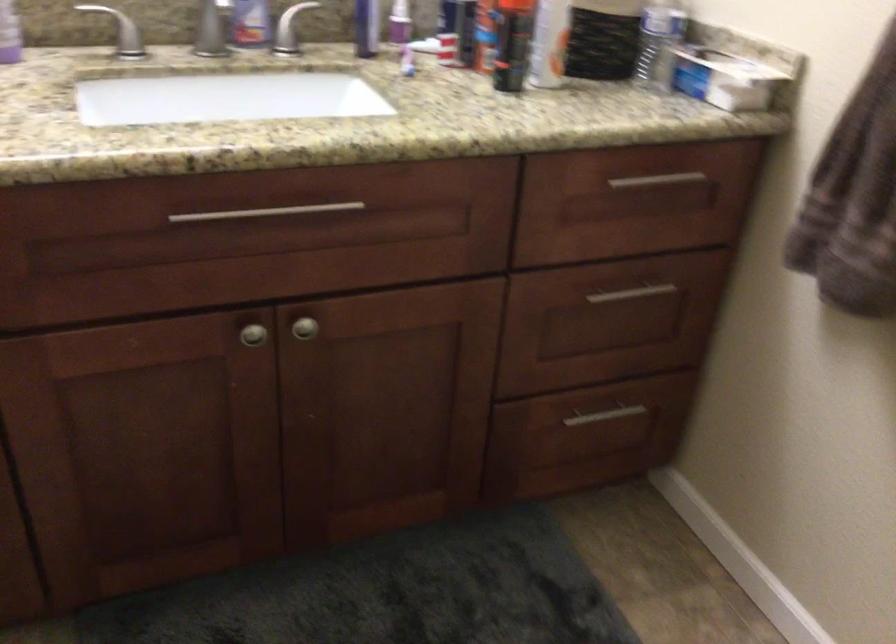
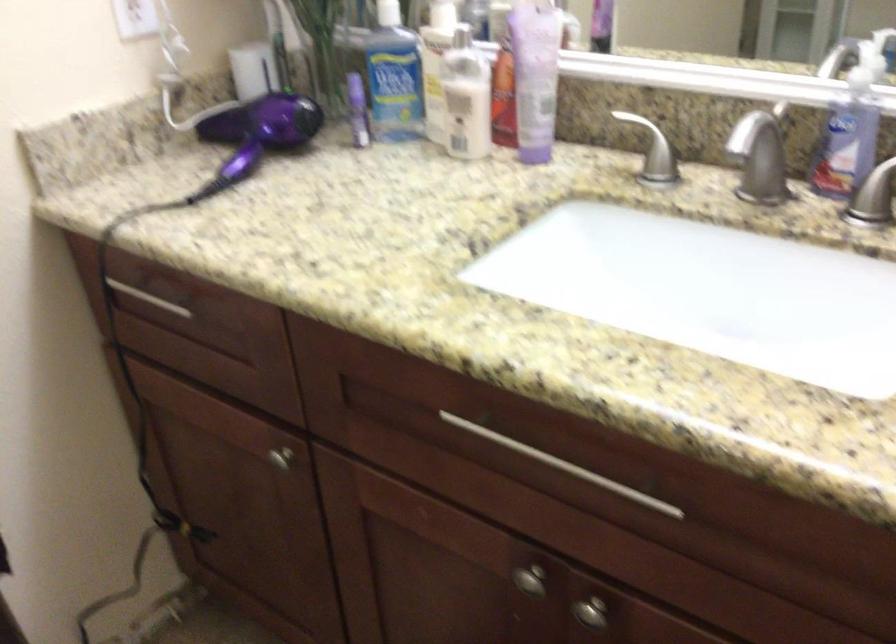
In the second image, find the point that corresponds to [309,327] in the first image.

(590, 612)